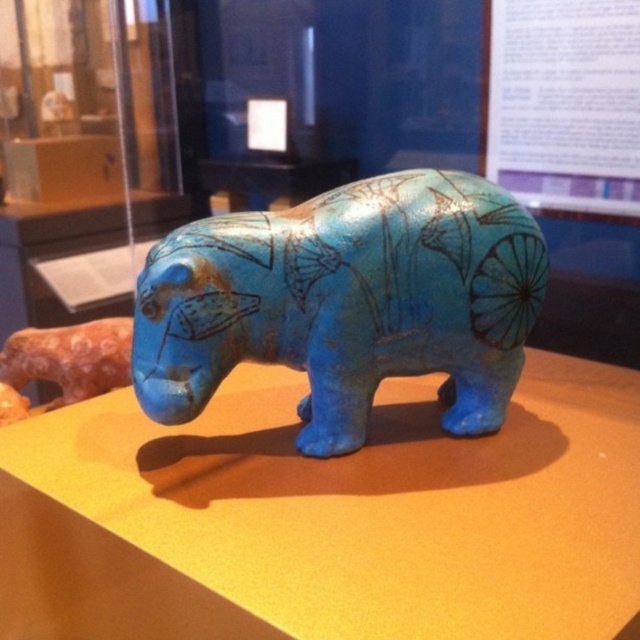
You are an art curator planning to display both the matte blue hippo at center and the blue glossy elephant at center in a new exhibition. Given their sizes, which one should be placed on a larger pedestal to ensure proper visibility?

The matte blue hippo at center is larger in size than the blue glossy elephant at center, so it should be placed on a larger pedestal to ensure proper visibility.

You are an art curator arranging a display. You have two sculptures in front of you, the matte blue hippo at center and the blue glossy elephant at center. The museum requires that the wider sculpture must be placed on the larger plinth. Which sculpture should be placed on the larger plinth?

The matte blue hippo at center should be placed on the larger plinth because its width is larger than the blue glossy elephant at center.